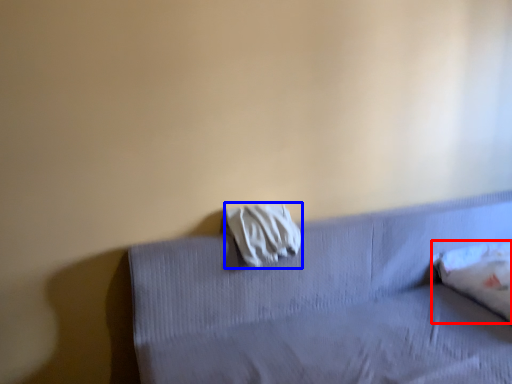
Question: Among these objects, which one is nearest to the camera, pillow (highlighted by a red box) or material (highlighted by a blue box)?

Choices:
 (A) pillow
 (B) material

Answer: (B)